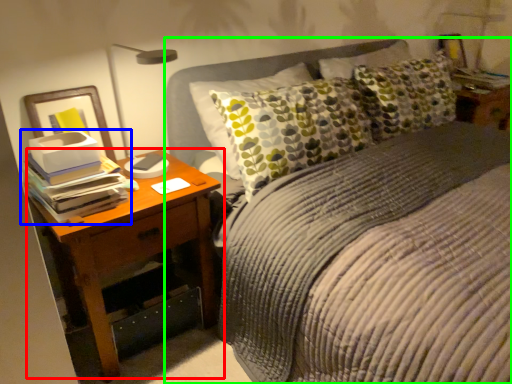
Question: Which object is the farthest from nightstand (highlighted by a red box)? Choose among these: book (highlighted by a blue box) or bed (highlighted by a green box).

Choices:
 (A) book
 (B) bed

Answer: (B)